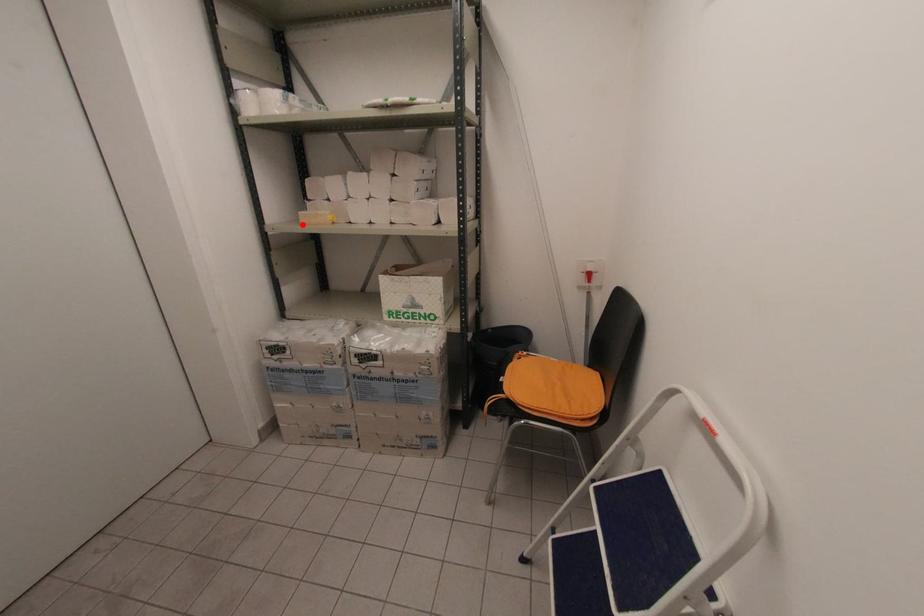
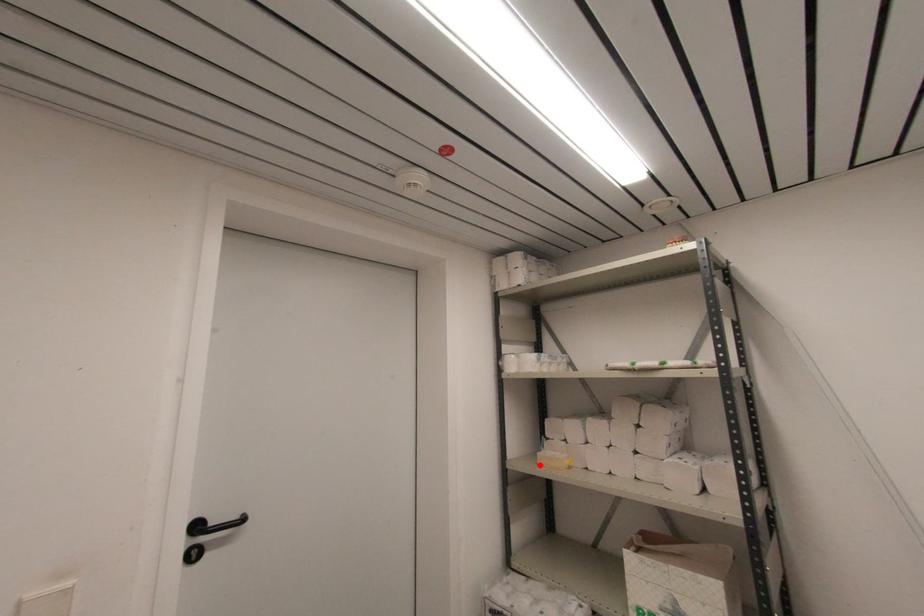
I am providing you with two images of the same scene from different viewpoints. A red point is marked on the first image and another point is marked on the second image. Are the points marked in image1 and image2 representing the same 3D position?

Yes